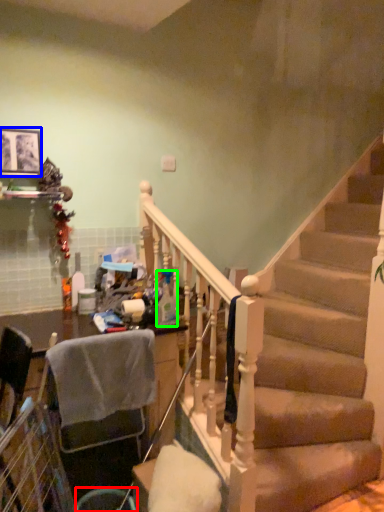
Question: Based on their relative distances, which object is farther from trash bin/can (highlighted by a red box)? Choose from picture frame (highlighted by a blue box) and bottle (highlighted by a green box).

Choices:
 (A) picture frame
 (B) bottle

Answer: (A)